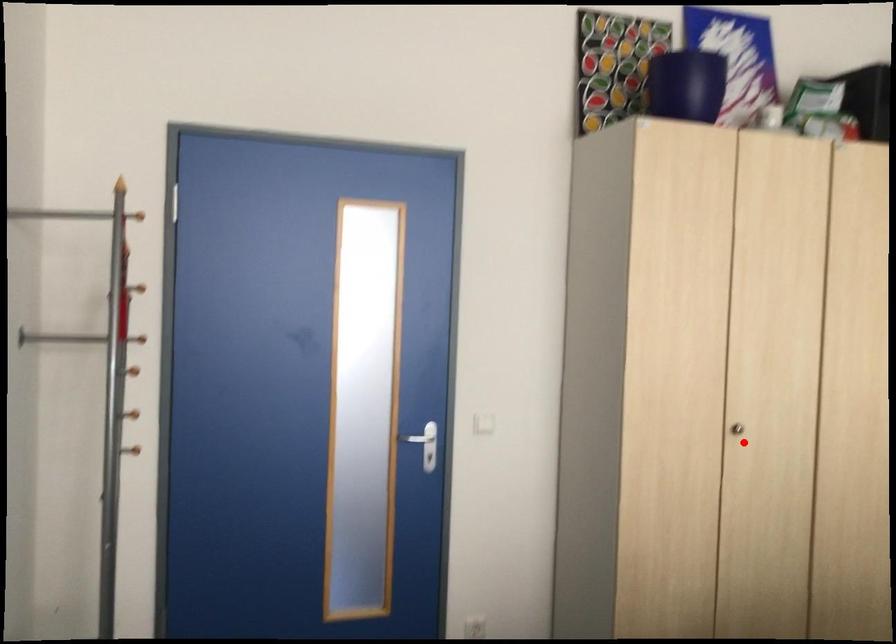
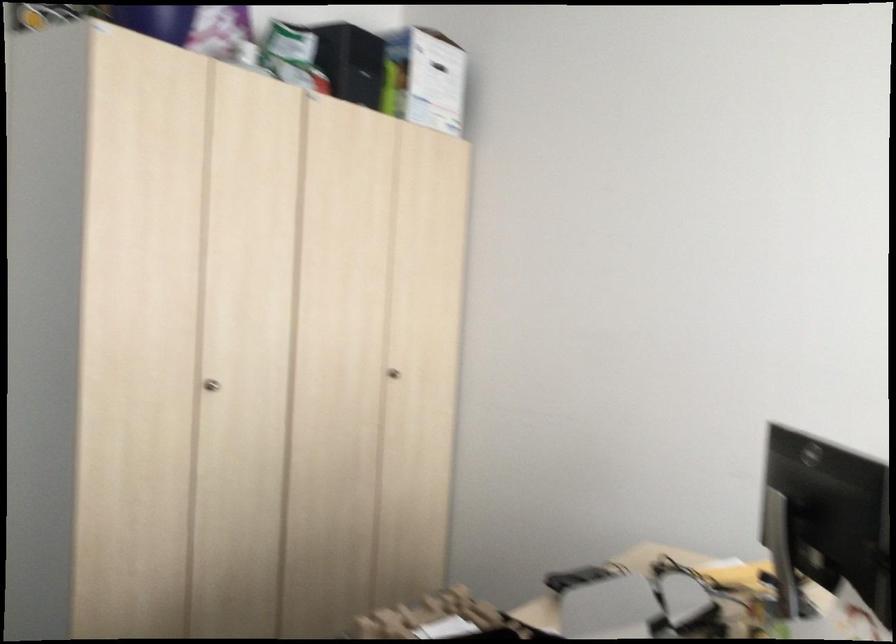
The point at the highlighted location is marked in the first image. Where is the corresponding point in the second image?

(211, 384)